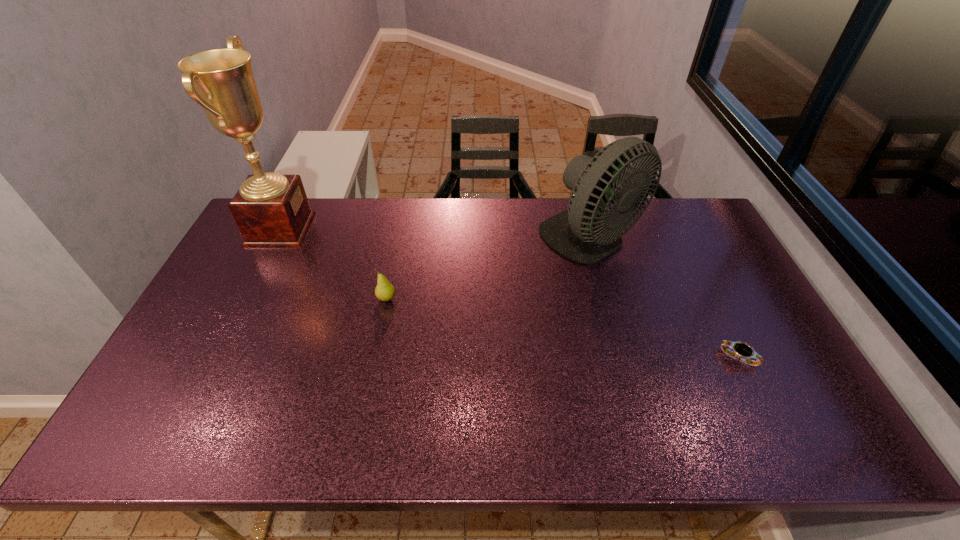
Identify the location of vacant area located on the right of the third tallest object. The image size is (960, 540). point(494,299).

The height and width of the screenshot is (540, 960). Identify the location of vacant position located on the back of the shortest object. (711, 304).

What are the coordinates of `trophy cup that is at the far edge` in the screenshot? It's located at pos(271,210).

At what (x,y) coordinates should I click in order to perform the action: click on fan that is at the far edge. Please return your answer as a coordinate pair (x, y). Looking at the image, I should click on (577, 233).

Where is `object present at the left edge`? object present at the left edge is located at coordinates (271, 210).

At what (x,y) coordinates should I click in order to perform the action: click on object that is at the right edge. Please return your answer as a coordinate pair (x, y). Image resolution: width=960 pixels, height=540 pixels. Looking at the image, I should click on (742, 351).

Where is `object positioned at the far left corner`? The width and height of the screenshot is (960, 540). object positioned at the far left corner is located at coordinates (271, 210).

You are a GUI agent. You are given a task and a screenshot of the screen. Output one action in this format:
    pyautogui.click(x=<x>, y=<y>)
    Task: Click on the free region at the far edge of the desktop
    This screenshot has width=960, height=540.
    Given the screenshot: What is the action you would take?
    pyautogui.click(x=657, y=227)

Locate an element on the screen. free spot at the near edge of the desktop is located at coordinates (671, 428).

Locate an element on the screen. free space at the left edge of the desktop is located at coordinates (202, 365).